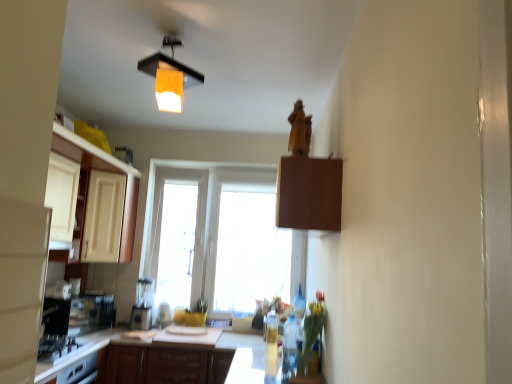
Question: Is matte white blender at center smaller than wooden cabinet at center, which ranks as the 2th cabinetry in back-to-front order?

Choices:
 (A) yes
 (B) no

Answer: (A)

Question: From the image's perspective, is matte white blender at center beneath wooden cabinet at center, marked as the first cabinetry in a bottom-to-top arrangement?

Choices:
 (A) yes
 (B) no

Answer: (B)

Question: Is matte white blender at center closer to camera compared to wooden cabinet at center, marked as the 2th cabinetry in a right-to-left arrangement?

Choices:
 (A) no
 (B) yes

Answer: (A)

Question: Is wooden cabinet at center, which ranks as the 2th cabinetry in back-to-front order, surrounded by matte white blender at center?

Choices:
 (A) yes
 (B) no

Answer: (B)

Question: Does matte white blender at center have a lesser height compared to wooden cabinet at center, which appears as the 2th cabinetry when viewed from the front?

Choices:
 (A) no
 (B) yes

Answer: (B)

Question: Is matte white blender at center positioned with its back to wooden cabinet at center, marked as the 2th cabinetry in a right-to-left arrangement?

Choices:
 (A) no
 (B) yes

Answer: (A)

Question: Is matte white cabinet at left, the second cabinetry from the top, shorter than translucent plastic bottle at center, acting as the 2th bottle starting from the front?

Choices:
 (A) yes
 (B) no

Answer: (B)

Question: Is matte white cabinet at left, the second cabinetry from the top, to the right of translucent plastic bottle at center, acting as the 2th bottle starting from the front, from the viewer's perspective?

Choices:
 (A) no
 (B) yes

Answer: (A)

Question: Could translucent plastic bottle at center, acting as the 2th bottle starting from the front, be considered to be inside matte white cabinet at left, arranged as the second cabinetry when ordered from the bottom?

Choices:
 (A) yes
 (B) no

Answer: (B)

Question: Does matte white cabinet at left, marked as the first cabinetry in a left-to-right arrangement, have a smaller size compared to translucent plastic bottle at center, the first bottle positioned from the back?

Choices:
 (A) no
 (B) yes

Answer: (A)

Question: Is matte white cabinet at left, marked as the first cabinetry in a left-to-right arrangement, located outside translucent plastic bottle at center, the first bottle positioned from the back?

Choices:
 (A) no
 (B) yes

Answer: (B)

Question: Does matte white cabinet at left, arranged as the second cabinetry when ordered from the bottom, come behind translucent plastic bottle at center, acting as the 2th bottle starting from the front?

Choices:
 (A) no
 (B) yes

Answer: (B)

Question: Is wooden panel at upper center not near translucent glass vase at lower center?

Choices:
 (A) no
 (B) yes

Answer: (B)